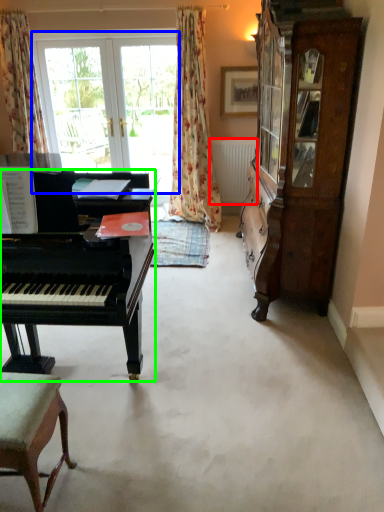
Question: Based on their relative distances, which object is farther from radiator (highlighted by a red box)? Choose from bay window (highlighted by a blue box) and piano (highlighted by a green box).

Choices:
 (A) bay window
 (B) piano

Answer: (B)